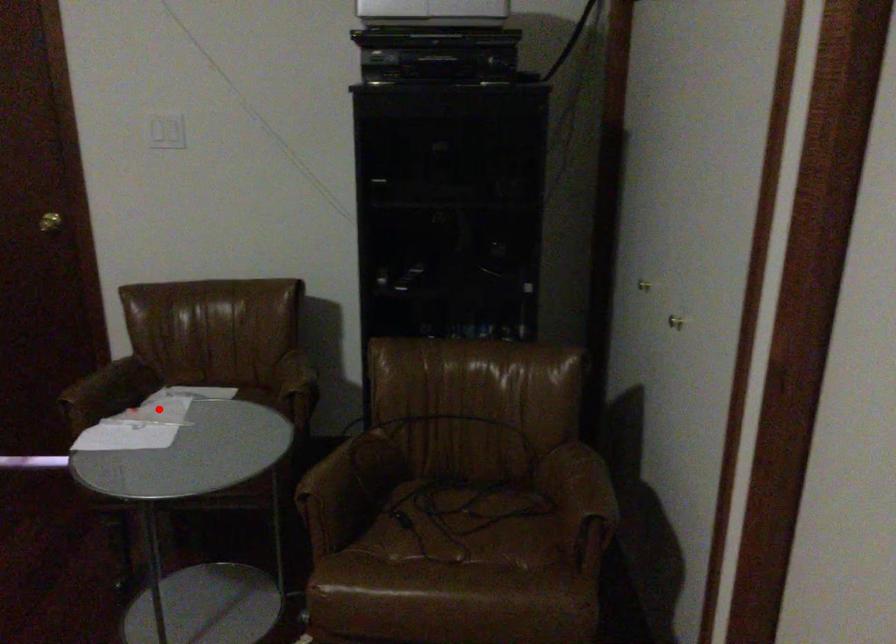
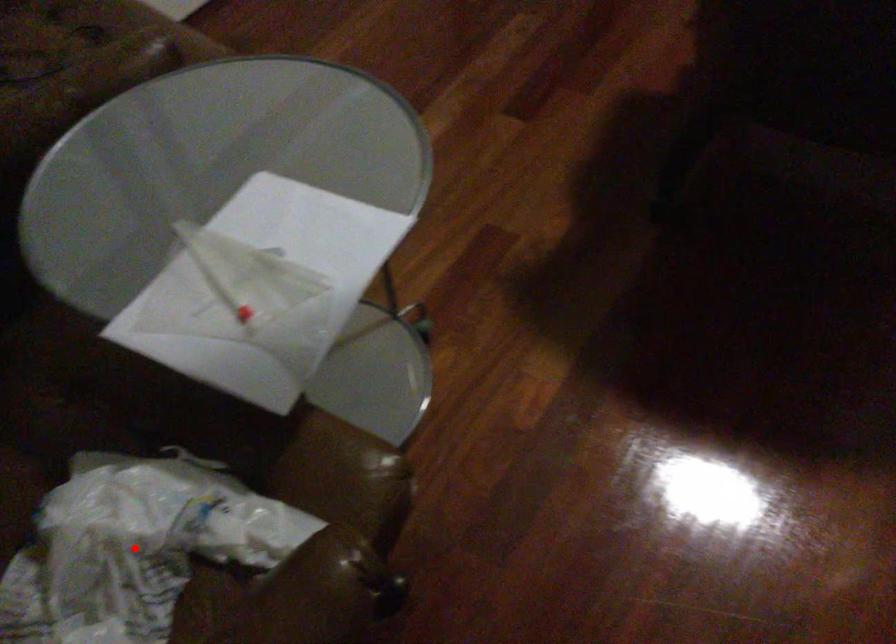
I am providing you with two images of the same scene from different viewpoints. A red point is marked on the first image and another point is marked on the second image. Do the highlighted points in image1 and image2 indicate the same real-world spot?

Yes